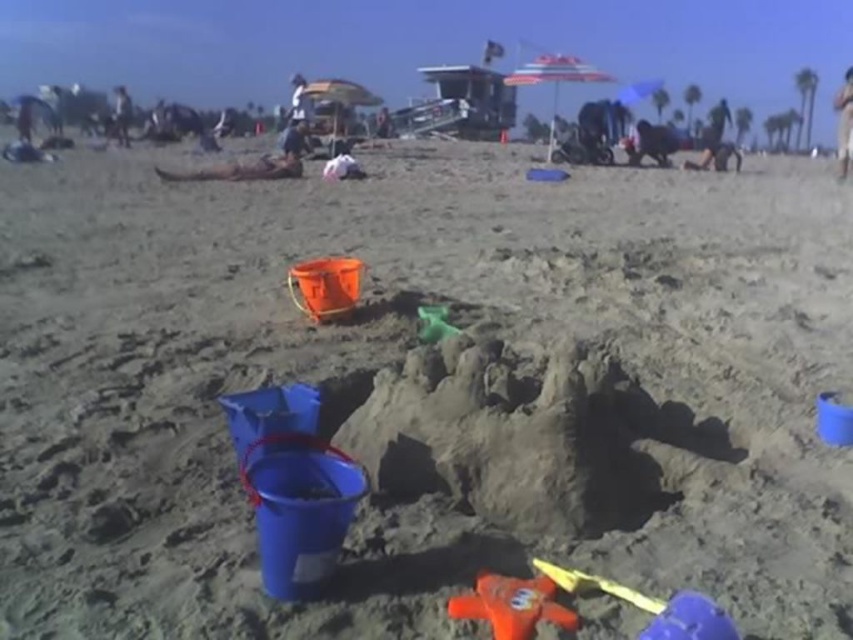
Question: Can you confirm if blue rubber toy at lower right is positioned above brown wooden surfboard at upper center?

Choices:
 (A) yes
 (B) no

Answer: (B)

Question: Which object appears farthest from the camera in this image?

Choices:
 (A) white plastic umbrella at upper center
 (B) smooth skin person at upper left
 (C) rubber orange starfish at center

Answer: (B)

Question: Is the position of brown wooden surfboard at upper center less distant than that of smooth skin person at upper left?

Choices:
 (A) yes
 (B) no

Answer: (A)

Question: Which of the following is the farthest from the observer?

Choices:
 (A) (844, 81)
 (B) (683, 614)
 (C) (305, 145)
 (D) (126, 115)

Answer: (A)

Question: Which object is the closest to the blue rubber toy at lower right?

Choices:
 (A) brown wooden surfboard at upper center
 (B) smooth tan skin at upper right
 (C) rubber orange starfish at center

Answer: (C)

Question: Is white plastic umbrella at upper center closer to the viewer compared to green rubber toy at center?

Choices:
 (A) yes
 (B) no

Answer: (B)